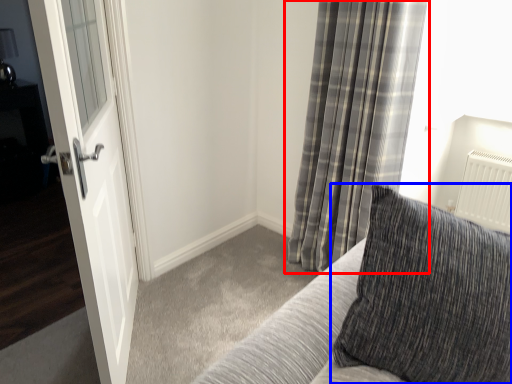
Question: Which point is further to the camera, curtain (highlighted by a red box) or pillow (highlighted by a blue box)?

Choices:
 (A) curtain
 (B) pillow

Answer: (A)